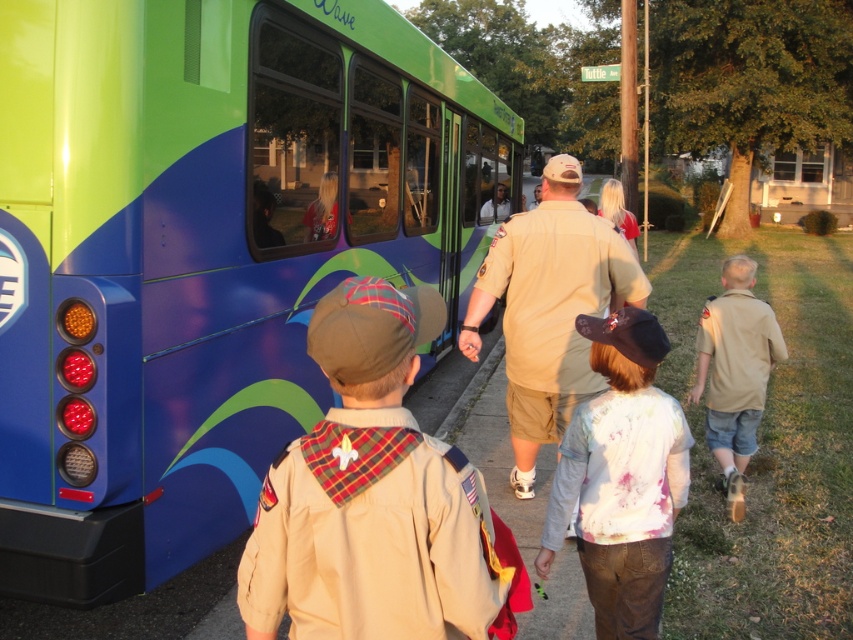
Looking at this image, measure the distance from khaki uniform at center to shiny red jacket at bus window.

khaki uniform at center is 9.34 feet away from shiny red jacket at bus window.

From the picture: Which is more to the left, khaki uniform at center or shiny red jacket at bus window?

shiny red jacket at bus window is more to the left.

What do you see at coordinates (370, 493) in the screenshot?
I see `khaki uniform at center` at bounding box center [370, 493].

Where is `khaki uniform at center`? The image size is (853, 640). khaki uniform at center is located at coordinates (370, 493).

Can you confirm if tie-dye fabric shirt at center is shorter than tan uniform at lower right?

Indeed, tie-dye fabric shirt at center has a lesser height compared to tan uniform at lower right.

Locate an element on the screen. The width and height of the screenshot is (853, 640). tie-dye fabric shirt at center is located at coordinates (621, 477).

Is point (641, 408) farther from camera compared to point (741, 458)?

That is False.

Identify the location of tie-dye fabric shirt at center. The height and width of the screenshot is (640, 853). (621, 477).

Is point (166, 212) closer to camera compared to point (757, 369)?

Yes, point (166, 212) is in front of point (757, 369).

Does green matte bus at left come behind tan uniform at lower right?

No, it is in front of tan uniform at lower right.

Is point (68, 234) closer to viewer compared to point (730, 404)?

Yes.

You are a GUI agent. You are given a task and a screenshot of the screen. Output one action in this format:
    pyautogui.click(x=<x>, y=<y>)
    Task: Click on the green matte bus at left
    
    Given the screenshot: What is the action you would take?
    pyautogui.click(x=202, y=253)